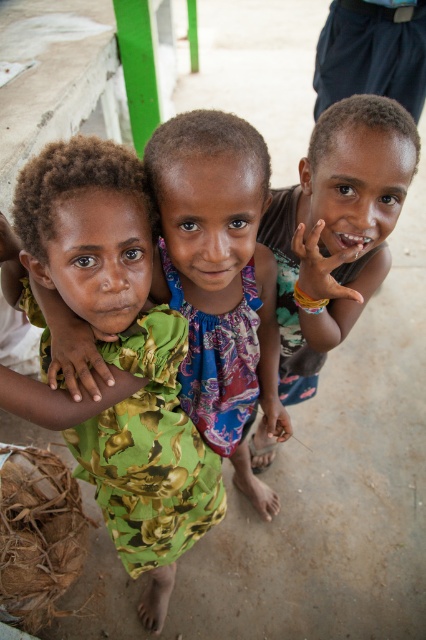
Can you confirm if green floral dress at center is smaller than brown matte skin at center?

Actually, green floral dress at center might be larger than brown matte skin at center.

Between green floral dress at center and brown matte skin at center, which one is positioned higher?

brown matte skin at center is above.

Is point (192, 499) behind point (308, 252)?

That is True.

Where is `green floral dress at center`? green floral dress at center is located at coordinates (123, 355).